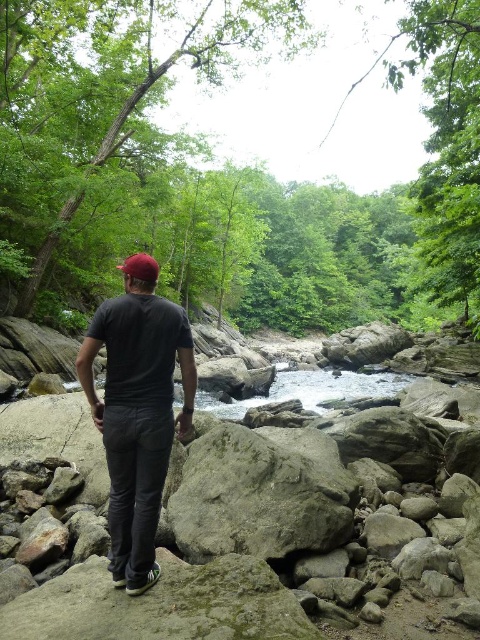
You are a drone operator trying to locate a specific point in the image. The point is at coordinates point (x=136, y=417). Which object in the scene is this point located on?

The point (x=136, y=417) is on the dark gray cotton t shirt at center.